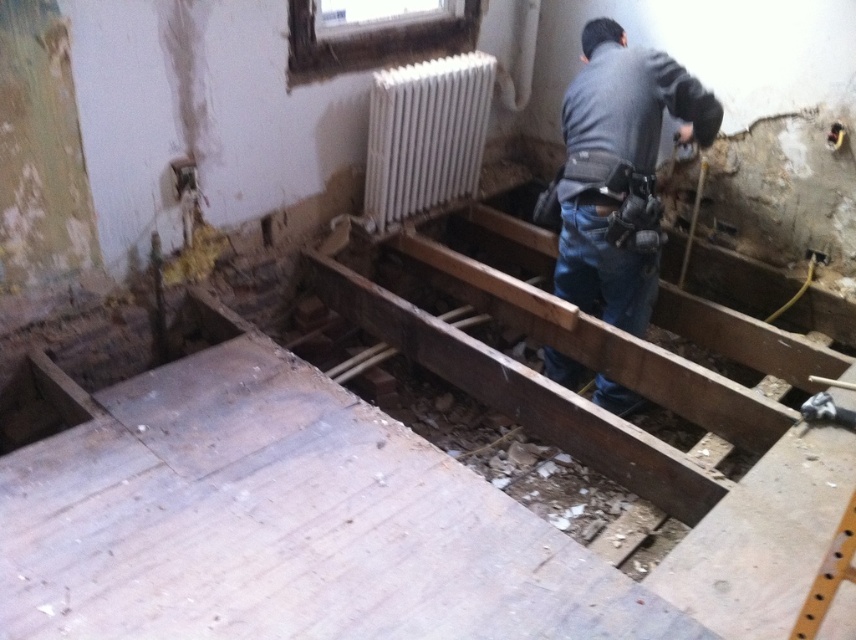
Question: Observing the image, what is the correct spatial positioning of white metallic radiator at upper center in reference to dark brown wooden hole at lower left?

Choices:
 (A) below
 (B) above

Answer: (B)

Question: Does dark gray shirt at center have a lesser width compared to white metallic radiator at upper center?

Choices:
 (A) yes
 (B) no

Answer: (B)

Question: Which point is farther to the camera?

Choices:
 (A) white metallic radiator at upper center
 (B) dark brown wooden hole at lower left
 (C) dark gray shirt at center

Answer: (A)

Question: Estimate the real-world distances between objects in this image. Which object is closer to the dark brown wooden hole at lower left?

Choices:
 (A) dark gray shirt at center
 (B) white metallic radiator at upper center

Answer: (B)

Question: Is dark gray shirt at center closer to camera compared to white metallic radiator at upper center?

Choices:
 (A) no
 (B) yes

Answer: (B)

Question: Estimate the real-world distances between objects in this image. Which object is farther from the white metallic radiator at upper center?

Choices:
 (A) dark gray shirt at center
 (B) dark brown wooden hole at lower left

Answer: (B)